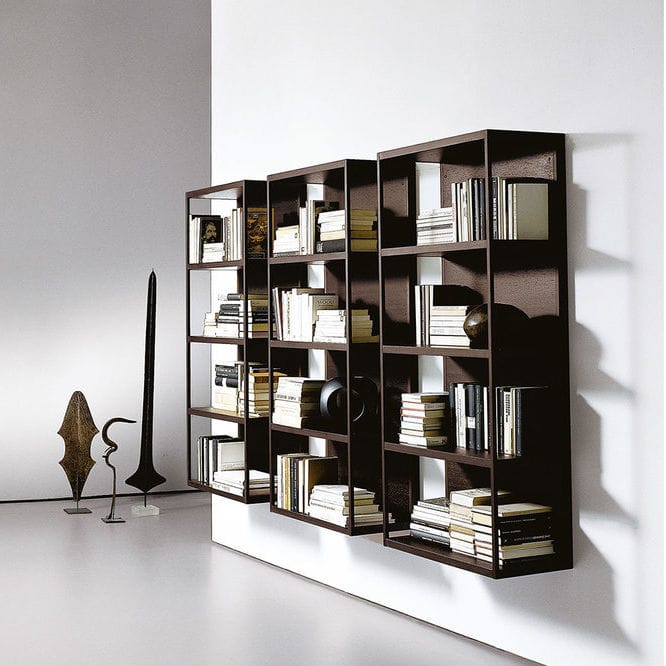
You are a GUI agent. You are given a task and a screenshot of the screen. Output one action in this format:
    pyautogui.click(x=<x>, y=<y>)
    Task: Click on the bookshelf one
    Image resolution: width=666 pixels, height=666 pixels.
    Given the screenshot: What is the action you would take?
    pyautogui.click(x=226, y=228), pyautogui.click(x=228, y=302), pyautogui.click(x=212, y=401), pyautogui.click(x=222, y=463)